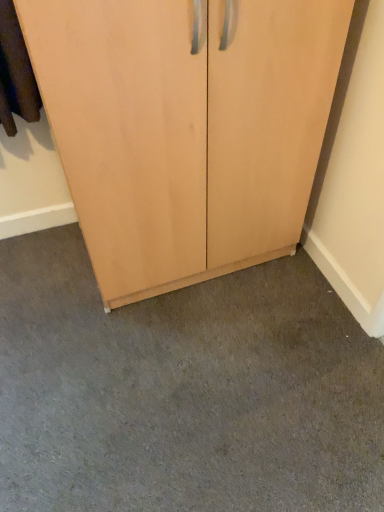
I want to click on empty space that is ontop of gray carpet at lower center (from a real-world perspective), so click(x=195, y=365).